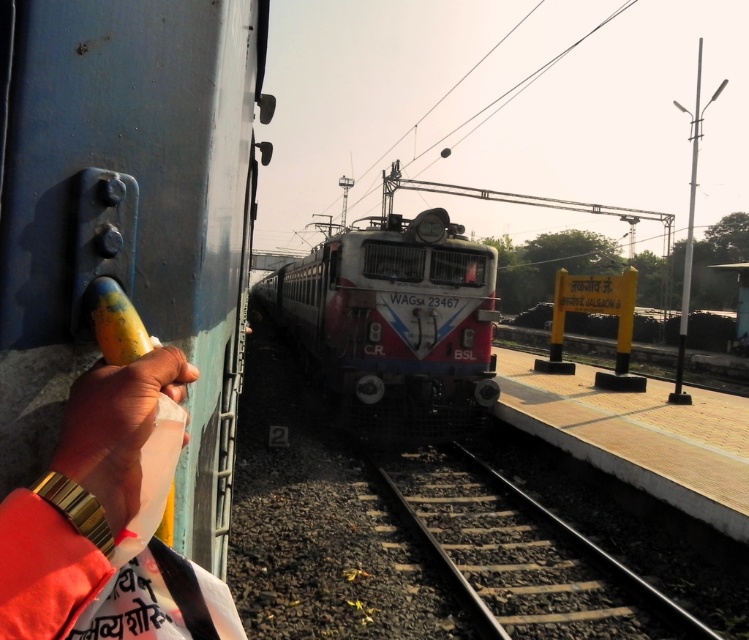
Locate an element on the screen. The image size is (749, 640). white glossy train at center is located at coordinates (394, 324).

Does white glossy train at center have a smaller size compared to gold watch at left?

No, white glossy train at center is not smaller than gold watch at left.

Who is more forward, (x=491, y=259) or (x=67, y=461)?

Positioned in front is point (x=67, y=461).

The image size is (749, 640). I want to click on white glossy train at center, so click(394, 324).

Does smooth metal train track at center have a greater height compared to smooth yellow banana at left?

Correct, smooth metal train track at center is much taller as smooth yellow banana at left.

Does smooth metal train track at center appear under smooth yellow banana at left?

Indeed, smooth metal train track at center is positioned under smooth yellow banana at left.

Who is more forward, (554, 536) or (115, 515)?

A: Point (115, 515)

Image resolution: width=749 pixels, height=640 pixels. I want to click on smooth metal train track at center, so click(521, 556).

Is point (515, 547) positioned in front of point (76, 550)?

No, (515, 547) is behind (76, 550).

Which is more to the left, smooth metal train track at center or gold watch at left?

gold watch at left

Is point (452, 561) farther from viewer compared to point (97, 400)?

Yes, it is.

Find the location of a particular element. This screenshot has height=640, width=749. smooth metal train track at center is located at coordinates pyautogui.click(x=521, y=556).